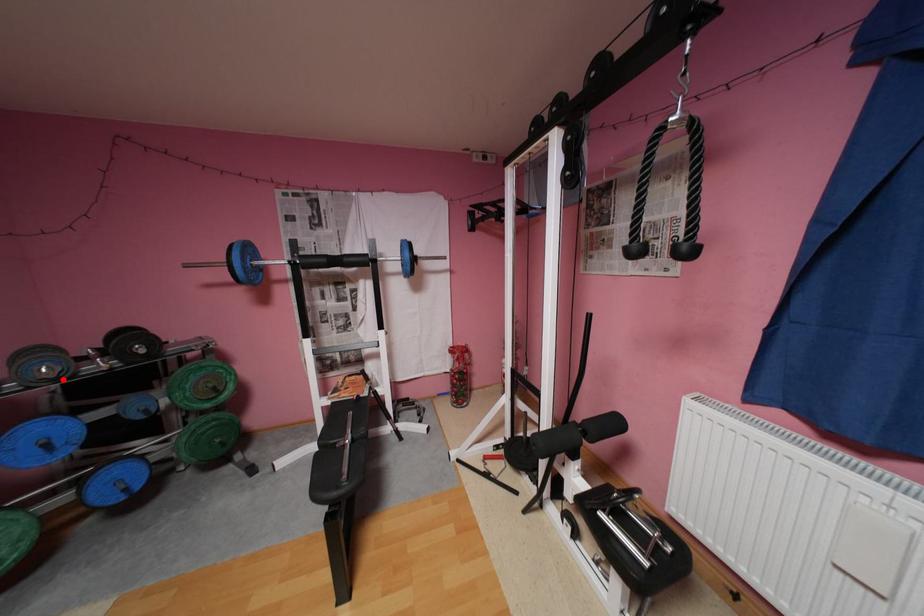
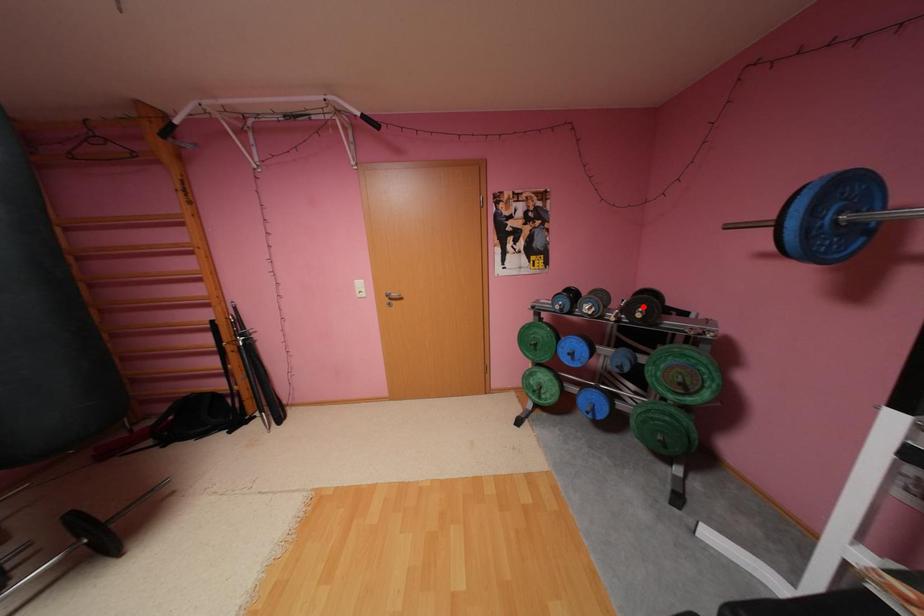
I am providing you with two images of the same scene from different viewpoints. A red point is marked on the first image and another point is marked on the second image. Does the point marked in image1 correspond to the same location as the one in image2?

No